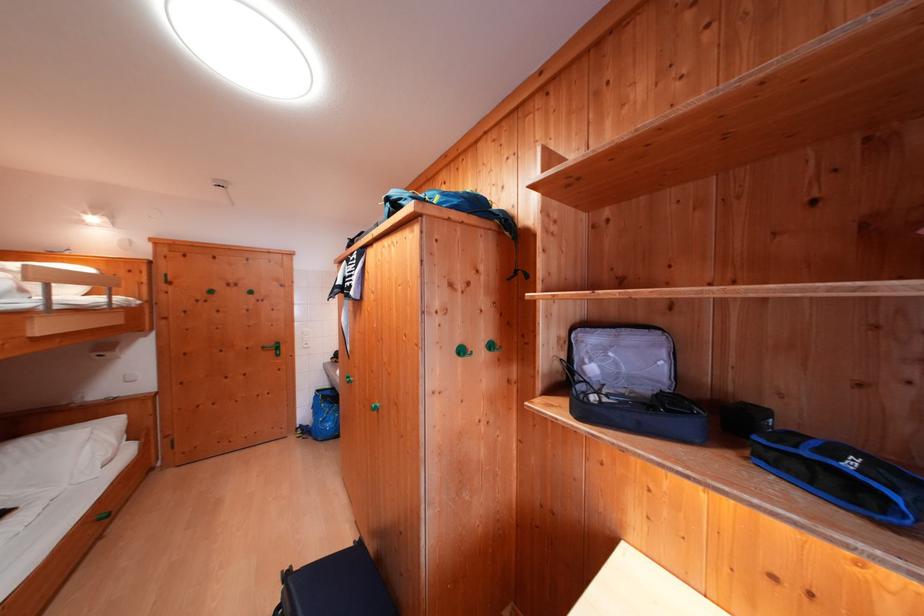
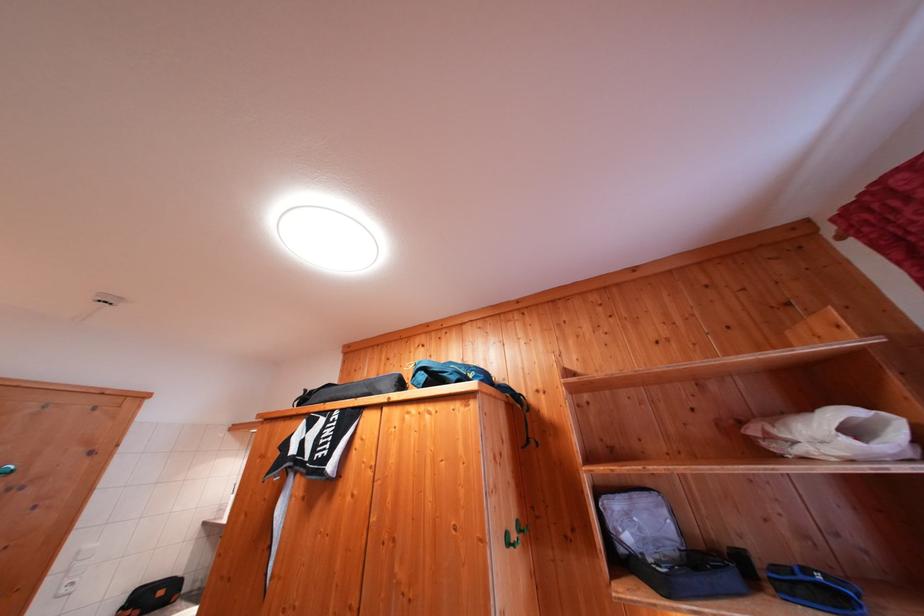
The images are taken continuously from a first-person perspective. In which direction is your viewpoint rotating?

The camera's rotation is toward right-up.